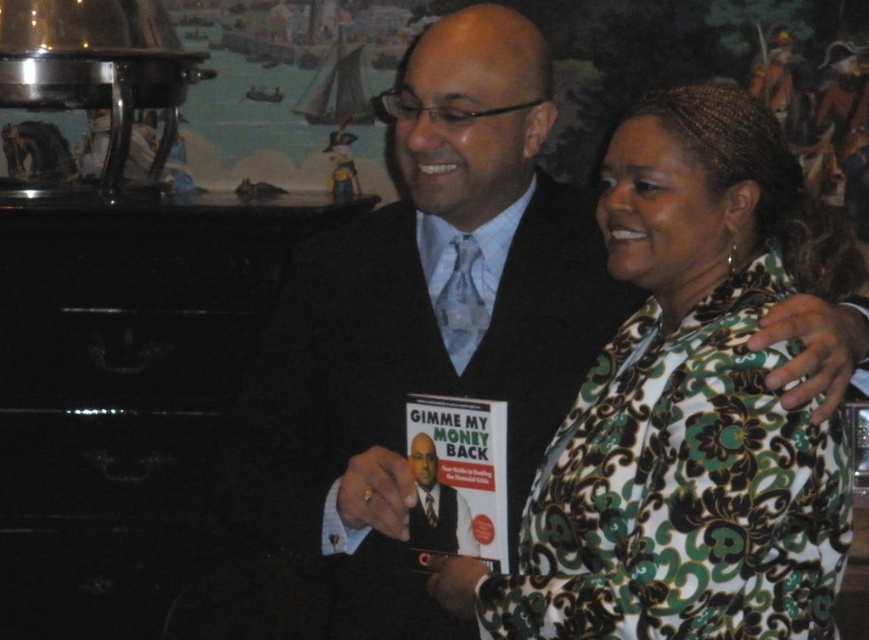
Question: Is green floral jacket at center to the left of matte black suit at center from the viewer's perspective?

Choices:
 (A) no
 (B) yes

Answer: (A)

Question: Which of the following is the farthest from the observer?

Choices:
 (A) (724, 160)
 (B) (452, 538)
 (C) (575, 214)

Answer: (C)

Question: Can you confirm if green floral jacket at center is thinner than matte black book at center?

Choices:
 (A) yes
 (B) no

Answer: (B)

Question: Is green floral jacket at center bigger than matte black suit at center?

Choices:
 (A) no
 (B) yes

Answer: (B)

Question: Which of the following is the closest to the observer?

Choices:
 (A) green floral jacket at center
 (B) matte black book at center

Answer: (A)

Question: Which point appears closest to the camera in this image?

Choices:
 (A) (355, 381)
 (B) (743, 113)
 (C) (434, 497)

Answer: (B)